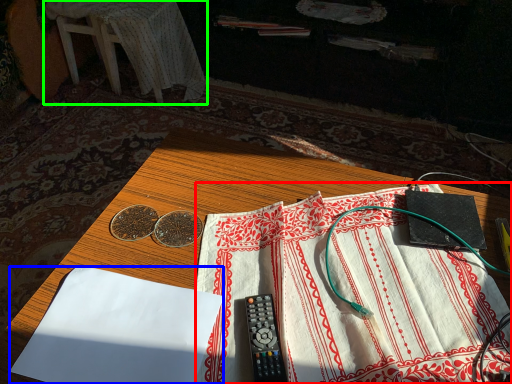
Question: Estimate the real-world distances between objects in this image. Which object is closer to sheet (highlighted by a red box), sheet (highlighted by a blue box) or furniture (highlighted by a green box)?

Choices:
 (A) sheet
 (B) furniture

Answer: (A)